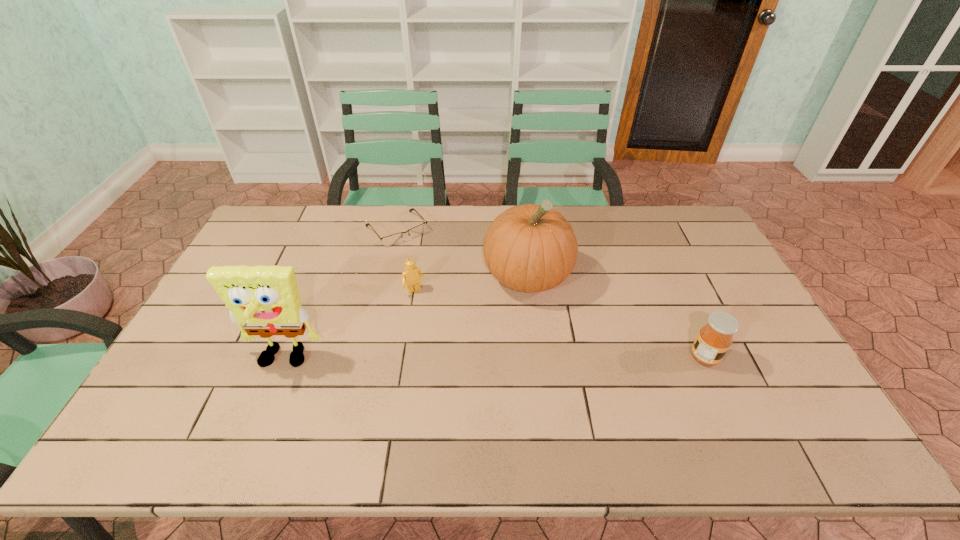
The width and height of the screenshot is (960, 540). Identify the location of the leftmost object. (264, 300).

Identify the location of honey. This screenshot has height=540, width=960. (714, 339).

You are a GUI agent. You are given a task and a screenshot of the screen. Output one action in this format:
    pyautogui.click(x=<x>, y=<y>)
    Task: Click on the third tallest object
    
    Given the screenshot: What is the action you would take?
    pyautogui.click(x=714, y=339)

Where is `pumpkin`? The image size is (960, 540). pumpkin is located at coordinates (530, 248).

In order to click on spectacles in this screenshot , I will do `click(393, 239)`.

Image resolution: width=960 pixels, height=540 pixels. In order to click on the fourth tallest object in this screenshot , I will do `click(410, 277)`.

This screenshot has width=960, height=540. What are the coordinates of `free location located on the face of the leftmost object` in the screenshot? It's located at (263, 411).

Where is `free location located 0.140m on the front-facing side of the honey`? The width and height of the screenshot is (960, 540). free location located 0.140m on the front-facing side of the honey is located at coordinates (771, 357).

You are a GUI agent. You are given a task and a screenshot of the screen. Output one action in this format:
    pyautogui.click(x=<x>, y=<y>)
    Task: Click on the free spot located on the stem of the pumpkin
    
    Given the screenshot: What is the action you would take?
    pyautogui.click(x=545, y=394)

Identify the location of free spot located 0.290m on the stem of the pumpkin. (545, 394).